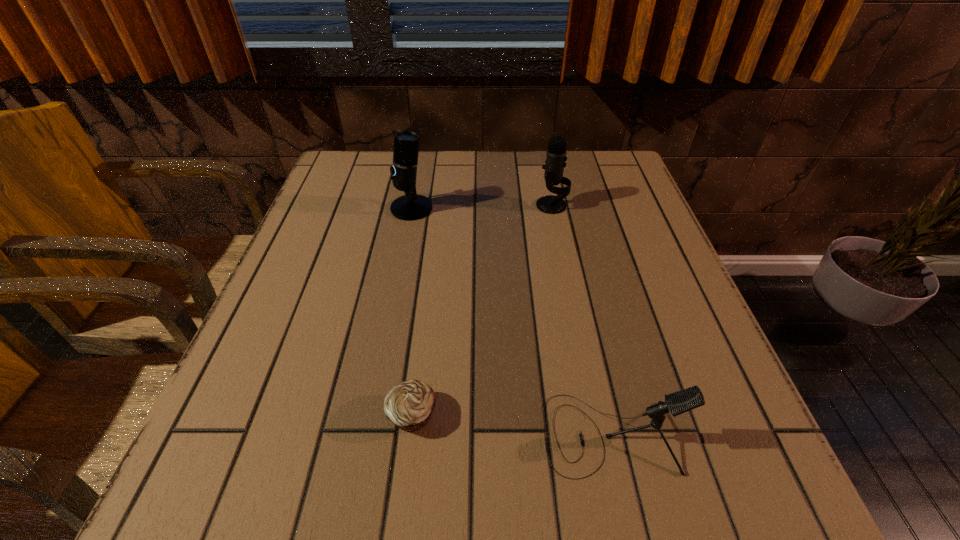
Locate an element on the screen. The height and width of the screenshot is (540, 960). free space between the shortest microphone and the muffin is located at coordinates (512, 424).

This screenshot has width=960, height=540. I want to click on vacant area that lies between the shortest object and the third tallest object, so click(512, 424).

This screenshot has height=540, width=960. Find the location of `vacant region between the shortest object and the shortest microphone`. vacant region between the shortest object and the shortest microphone is located at coordinates (512, 424).

Identify the location of object that ranks as the closest to the leftmost microphone. (556, 157).

Locate an element on the screen. This screenshot has height=540, width=960. object that is the closest to the shortest object is located at coordinates (679, 402).

I want to click on microphone that stands as the closest to the leftmost microphone, so click(556, 157).

Where is `the third closest microphone to the shortest object`? This screenshot has width=960, height=540. the third closest microphone to the shortest object is located at coordinates (556, 157).

Find the location of a particular element. The width and height of the screenshot is (960, 540). free spot that satisfies the following two spatial constraints: 1. on the front side of the shortest object; 2. on the right side of the leftmost microphone is located at coordinates (372, 415).